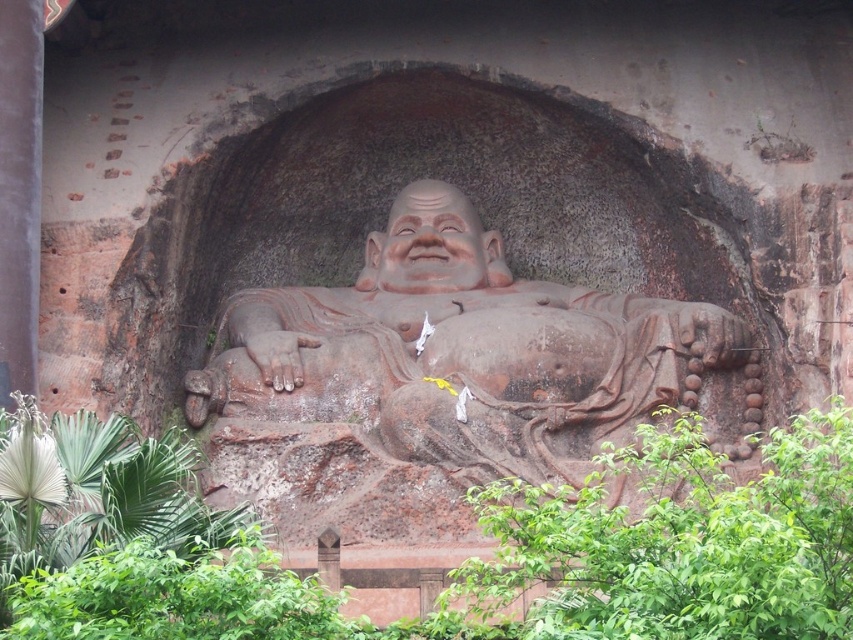
Question: Can you confirm if green leafy plant at lower center is wider than brown stone statue at center?

Choices:
 (A) yes
 (B) no

Answer: (A)

Question: Observing the image, what is the correct spatial positioning of green leafy plant at lower center in reference to brown stone statue at center?

Choices:
 (A) above
 (B) below

Answer: (B)

Question: Based on their relative distances, which object is nearer to the matte clay face at center?

Choices:
 (A) brown stone statue at center
 (B) green leafy plant at lower center

Answer: (A)

Question: Which of the following is the farthest from the observer?

Choices:
 (A) (463, 440)
 (B) (192, 576)
 (C) (418, 285)

Answer: (C)

Question: Can you confirm if green leafy plant at lower center is positioned below matte clay face at center?

Choices:
 (A) yes
 (B) no

Answer: (A)

Question: Which of the following is the closest to the observer?

Choices:
 (A) (257, 570)
 (B) (709, 328)

Answer: (A)